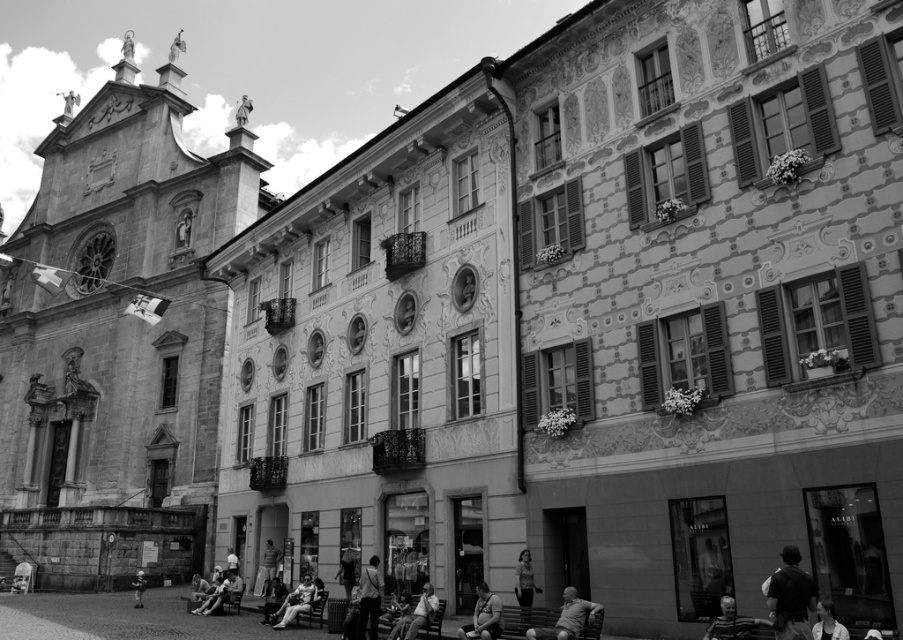
Question: Among these objects, which one is farthest from the camera?

Choices:
 (A) light gray fabric shirt at lower center
 (B) light gray fabric jacket at lower center
 (C) smooth white shirt at lower right
 (D) dark gray fabric shirt at lower right

Answer: (B)

Question: Is smooth gray shirt at lower center bigger than light gray fabric jacket at lower center?

Choices:
 (A) no
 (B) yes

Answer: (A)

Question: Estimate the real-world distances between objects in this image. Which object is closer to the light gray fabric jacket at lower center?

Choices:
 (A) dark gray fabric shirt at lower right
 (B) smooth leather jacket at center

Answer: (B)

Question: Can you confirm if dark gray fabric shirt at lower right is positioned to the left of matte black jacket at lower center?

Choices:
 (A) yes
 (B) no

Answer: (B)

Question: Which object is closer to the camera taking this photo?

Choices:
 (A) smooth white shirt at lower right
 (B) matte black dress at center
 (C) light gray fabric jacket at lower center
 (D) dark gray fabric shirt at lower right

Answer: (D)

Question: From the image, what is the correct spatial relationship of matte black jacket at lower center in relation to matte black dress at center?

Choices:
 (A) above
 (B) below

Answer: (B)